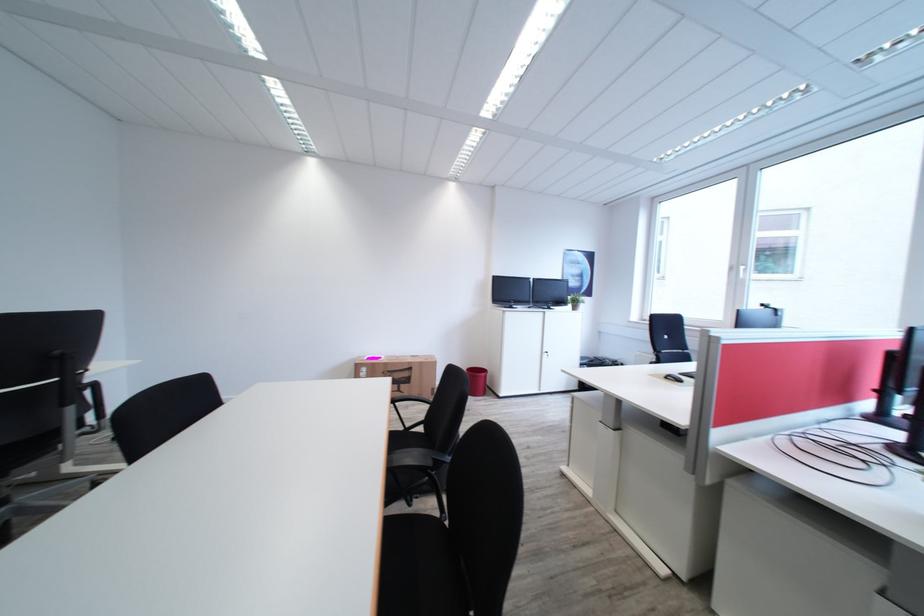
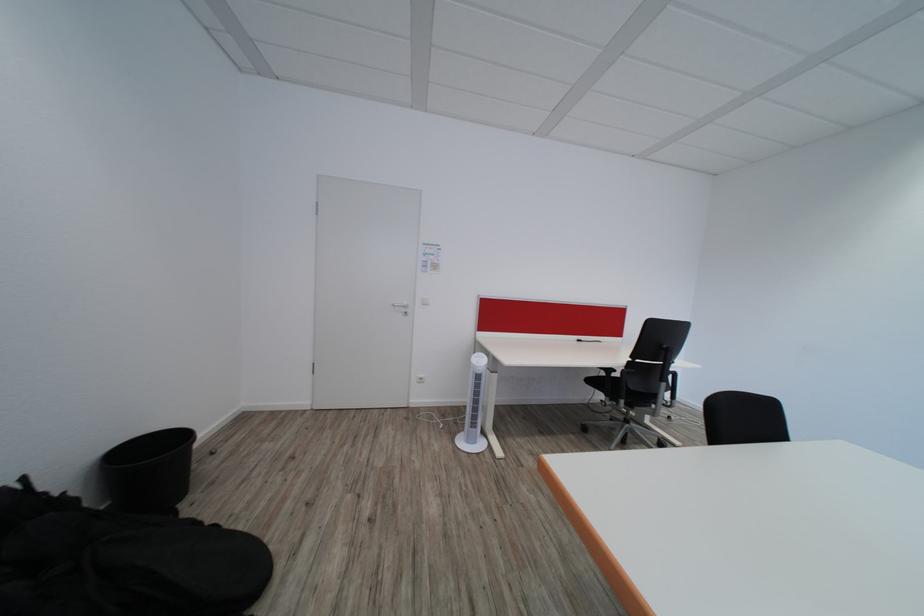
Find the pixel in the second image that matches [98,373] in the first image.

(684, 365)